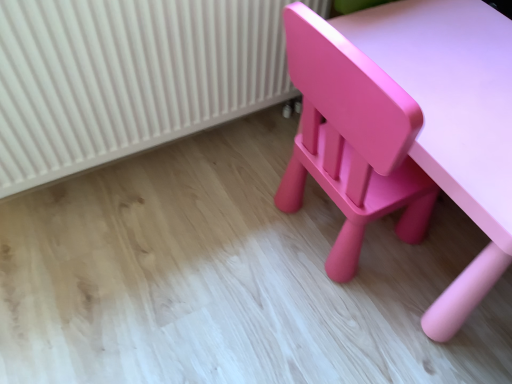
Question: From a real-world perspective, relative to white ribbed radiator at upper left, is matte pink table at lower right vertically above or below?

Choices:
 (A) above
 (B) below

Answer: (B)

Question: Is matte pink table at lower right wider or thinner than white ribbed radiator at upper left?

Choices:
 (A) wide
 (B) thin

Answer: (A)

Question: Relative to white ribbed radiator at upper left, is matte pink table at lower right in front or behind?

Choices:
 (A) behind
 (B) front

Answer: (B)

Question: Is white ribbed radiator at upper left bigger or smaller than matte pink table at lower right?

Choices:
 (A) big
 (B) small

Answer: (B)

Question: Is white ribbed radiator at upper left spatially inside matte pink table at lower right, or outside of it?

Choices:
 (A) inside
 (B) outside

Answer: (B)

Question: Relative to matte pink table at lower right, is white ribbed radiator at upper left in front or behind?

Choices:
 (A) behind
 (B) front

Answer: (A)

Question: Would you say white ribbed radiator at upper left is to the left or to the right of matte pink table at lower right in the picture?

Choices:
 (A) right
 (B) left

Answer: (B)